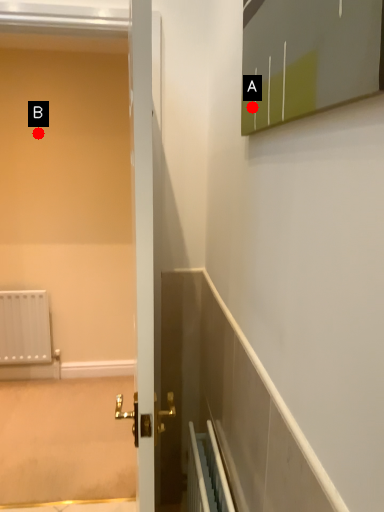
Question: Two points are circled on the image, labeled by A and B beside each circle. Which point is closer to the camera taking this photo?

Choices:
 (A) A is closer
 (B) B is closer

Answer: (A)